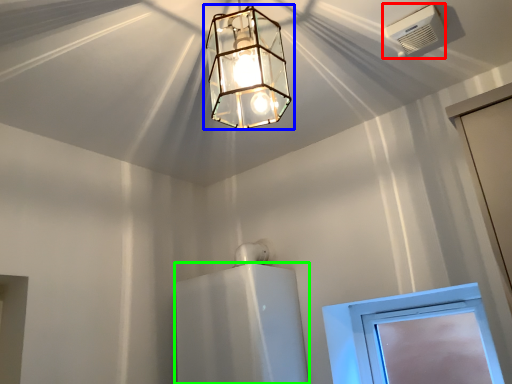
Question: Based on their relative distances, which object is nearer to air conditioning (highlighted by a red box)? Choose from lamp (highlighted by a blue box) and appliance (highlighted by a green box).

Choices:
 (A) lamp
 (B) appliance

Answer: (A)